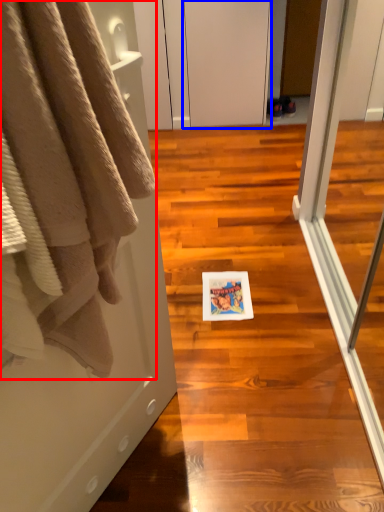
Question: Which of the following is the farthest to the observer, towel (highlighted by a red box) or screen door (highlighted by a blue box)?

Choices:
 (A) towel
 (B) screen door

Answer: (B)